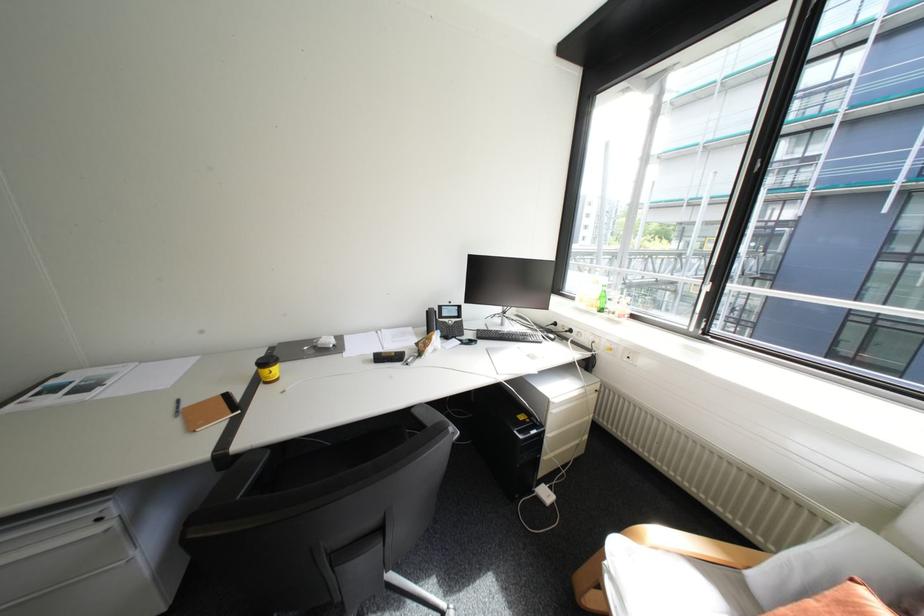
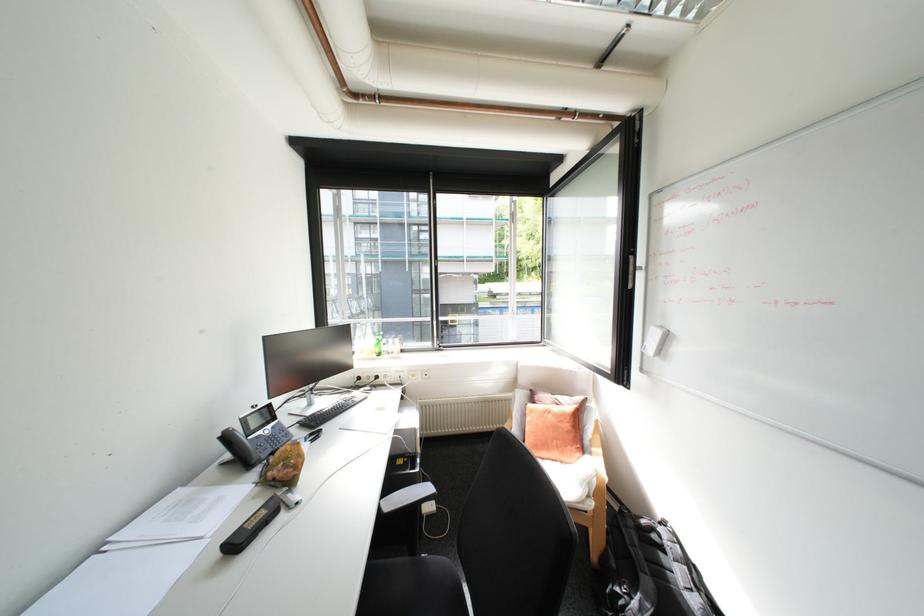
Find the pixel in the second image that matches the point at 598,306 in the first image.

(379, 354)